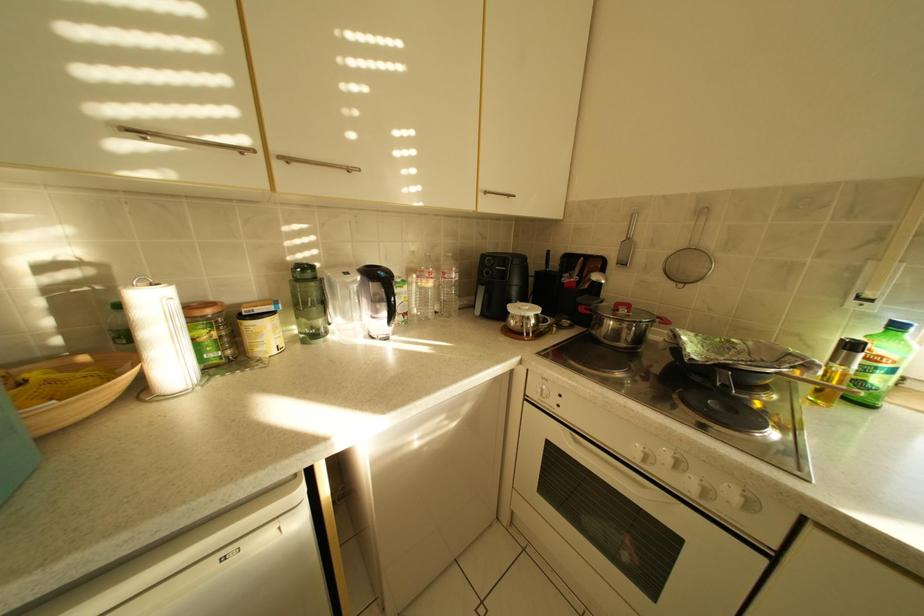
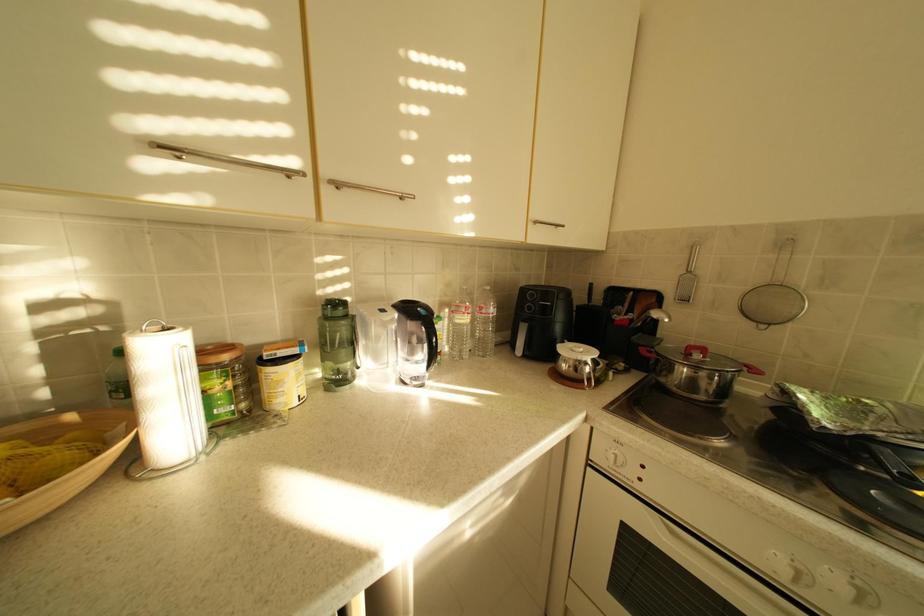
What movement of the cameraman would produce the second image?

The cameraman moved toward left, forward.